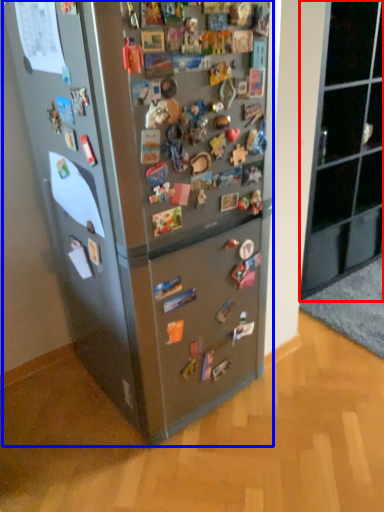
Question: Which of the following is the closest to the observer, cabinetry (highlighted by a red box) or refrigerator (highlighted by a blue box)?

Choices:
 (A) cabinetry
 (B) refrigerator

Answer: (B)